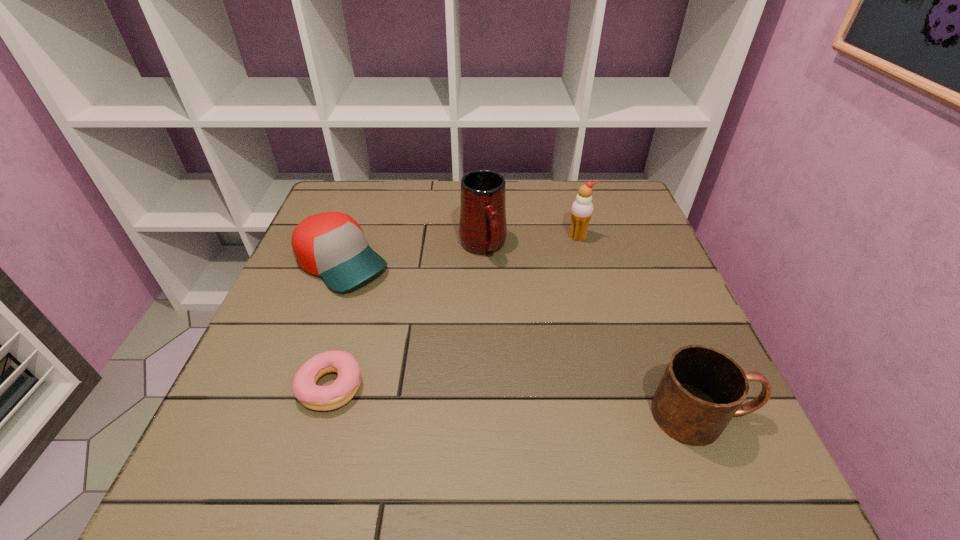
The width and height of the screenshot is (960, 540). I want to click on doughnut located in the left edge section of the desktop, so click(321, 398).

Identify the location of baseball cap present at the left edge. This screenshot has width=960, height=540. (332, 245).

Find the location of a particular element. The width and height of the screenshot is (960, 540). object that is at the right edge is located at coordinates (702, 388).

Locate an element on the screen. The height and width of the screenshot is (540, 960). object positioned at the near left corner is located at coordinates (321, 398).

Identify the location of object positioned at the near right corner. (702, 388).

This screenshot has height=540, width=960. Identify the location of free space at the far edge. (524, 225).

In the image, there is a desktop. Identify the location of vacant area at the left edge. (289, 279).

In the image, there is a desktop. Identify the location of free space at the right edge. (666, 287).

In the image, there is a desktop. Where is `free region at the far left corner`? This screenshot has height=540, width=960. free region at the far left corner is located at coordinates (327, 201).

Where is `vacant area at the near left corner`? vacant area at the near left corner is located at coordinates (257, 406).